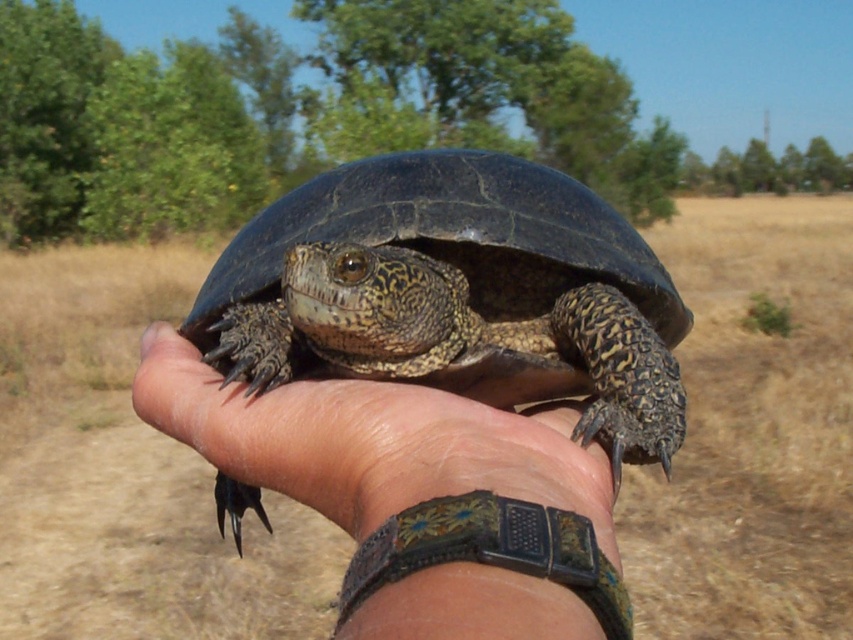
You are a photographer trying to capture a close shot of the shiny dark shell turtle at center and the leather wristwatch at center. Since you want to focus on both objects equally, which one should you adjust your camera focus for first, considering their sizes?

The shiny dark shell turtle at center is taller than the leather wristwatch at center, so you should focus on the shiny dark shell turtle at center first to ensure its details are clear before adjusting for the smaller leather wristwatch at center.

You are a photographer trying to capture a close shot of the turtle. You notice two points in the image labeled as point 1 at coordinates point (x=322, y=196) and point 2 at coordinates point (x=546, y=592). Which point is closer to your camera lens?

Point (x=322, y=196) is closer to the camera lens than point (x=546, y=592) because it is further to the camera than the other point.

You are a photographer trying to capture a clear photo of the leather wristwatch at center. However, the shiny dark shell turtle at center is blocking your view. Can you move the turtle to the side to get a better shot of the wristwatch?

The leather wristwatch at center is behind the shiny dark shell turtle at center, so moving the turtle to the side would allow you to see the wristwatch clearly.